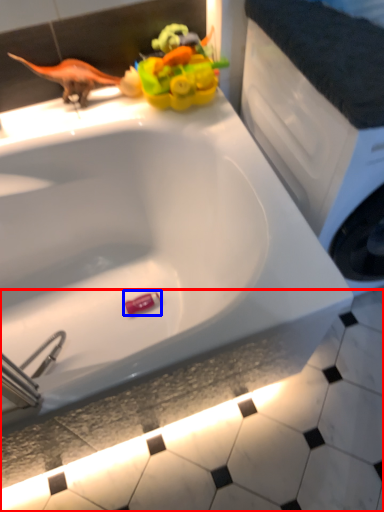
Question: Which object is closer to the camera taking this photo, tile (highlighted by a red box) or toy (highlighted by a blue box)?

Choices:
 (A) tile
 (B) toy

Answer: (A)